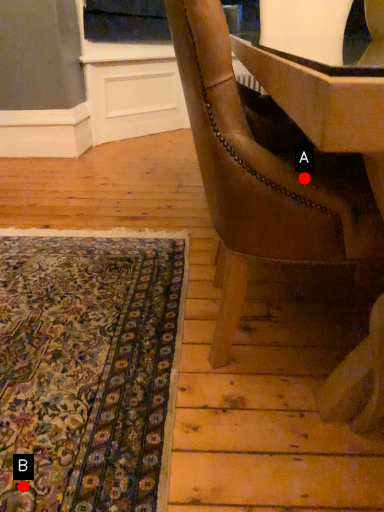
Question: Two points are circled on the image, labeled by A and B beside each circle. Which point is closer to the camera?

Choices:
 (A) A is closer
 (B) B is closer

Answer: (B)